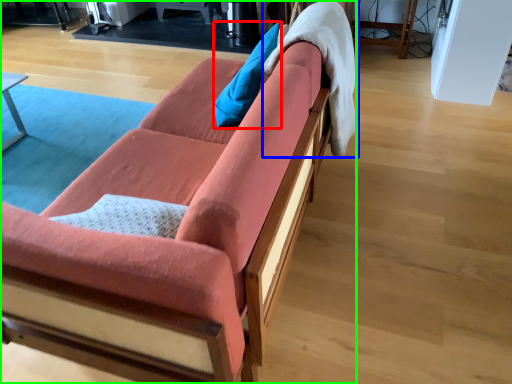
Question: Which object is the farthest from pillow (highlighted by a red box)? Choose among these: blanket (highlighted by a blue box) or studio couch (highlighted by a green box).

Choices:
 (A) blanket
 (B) studio couch

Answer: (B)